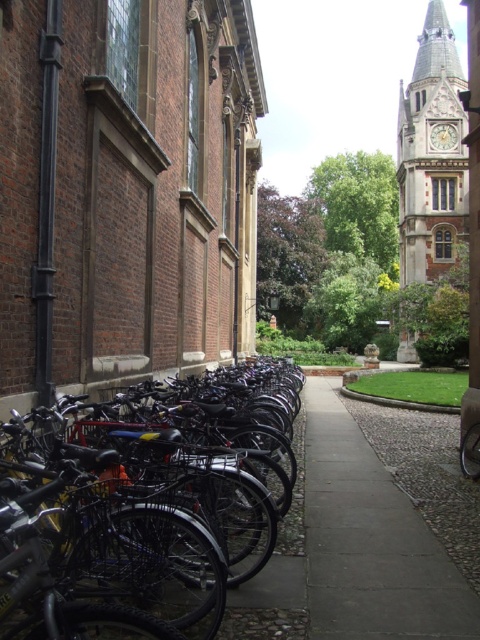
Is gray concrete pavement at center to the left of brown stone clock tower at upper right from the viewer's perspective?

Correct, you'll find gray concrete pavement at center to the left of brown stone clock tower at upper right.

Which is in front, point (321, 554) or point (465, 173)?

Point (321, 554) is more forward.

Identify the location of gray concrete pavement at center. This screenshot has height=640, width=480. pos(371,541).

I want to click on gray concrete pavement at center, so click(x=371, y=541).

Can you confirm if black matte bicycle at left is thinner than gray concrete pavement at center?

No, black matte bicycle at left is not thinner than gray concrete pavement at center.

Consider the image. Is black matte bicycle at left positioned in front of gray concrete pavement at center?

Yes.

Is point (244, 512) behind point (364, 564)?

That is True.

This screenshot has height=640, width=480. Identify the location of black matte bicycle at left. (x=159, y=528).

Can you confirm if black matte bicycle at left is bigger than brown stone clock tower at upper right?

Incorrect, black matte bicycle at left is not larger than brown stone clock tower at upper right.

Who is shorter, black matte bicycle at left or brown stone clock tower at upper right?

With less height is black matte bicycle at left.

Locate an element on the screen. The image size is (480, 640). black matte bicycle at left is located at coordinates (159, 528).

I want to click on black matte bicycle at left, so click(159, 528).